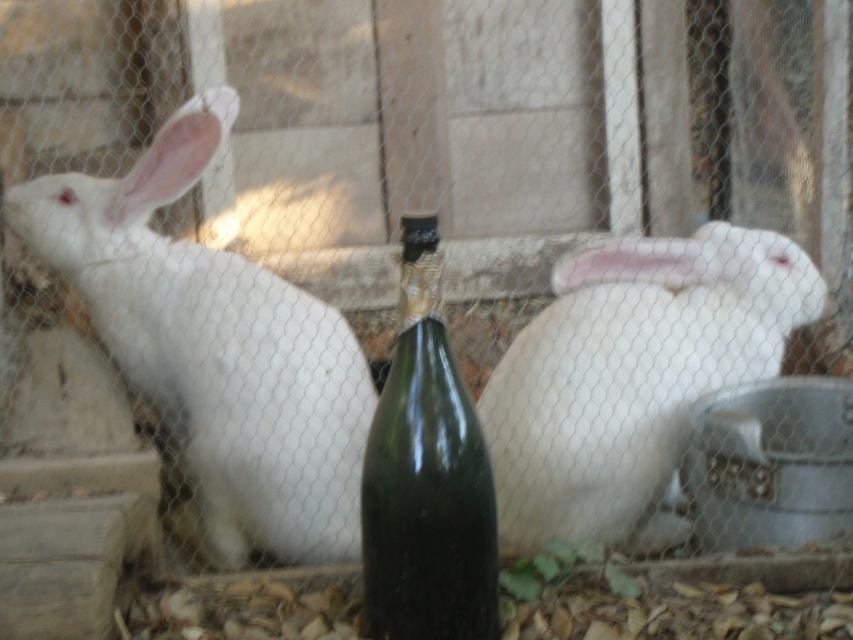
Question: Is the position of white matte fur at left more distant than that of green glass bottle at center?

Choices:
 (A) no
 (B) yes

Answer: (B)

Question: Does white matte fur at left appear on the left side of white matte fur at center?

Choices:
 (A) no
 (B) yes

Answer: (B)

Question: Does white matte fur at center have a larger size compared to green glass bottle at center?

Choices:
 (A) yes
 (B) no

Answer: (A)

Question: Which point is farther from the camera taking this photo?

Choices:
 (A) (448, 388)
 (B) (144, 349)
 (C) (579, 301)

Answer: (B)

Question: Which of the following is the farthest from the observer?

Choices:
 (A) green glass bottle at center
 (B) white matte fur at left

Answer: (B)

Question: Which point appears closest to the camera in this image?

Choices:
 (A) (219, 326)
 (B) (740, 365)
 (C) (378, 500)

Answer: (C)